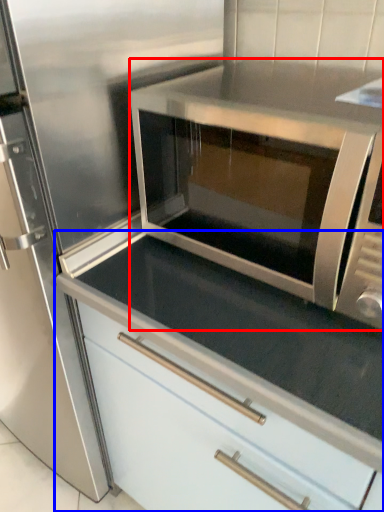
Question: Which object appears closest to the camera in this image, microwave oven (highlighted by a red box) or cabinetry (highlighted by a blue box)?

Choices:
 (A) microwave oven
 (B) cabinetry

Answer: (A)